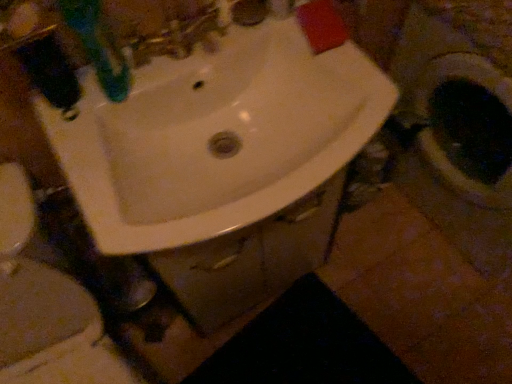
Locate an element on the screen. vacant area situated below black matte rug at lower center (from a real-world perspective) is located at coordinates pyautogui.click(x=313, y=359).